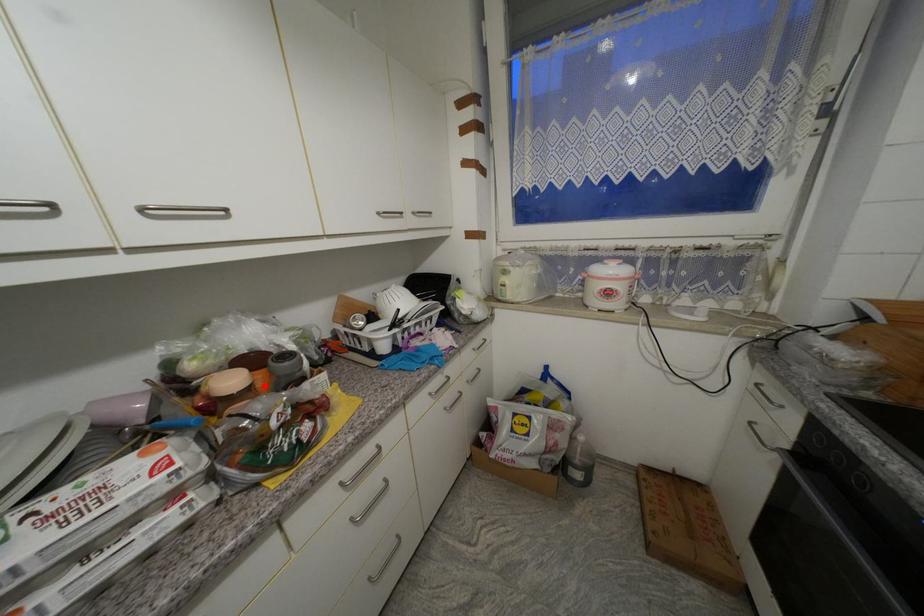
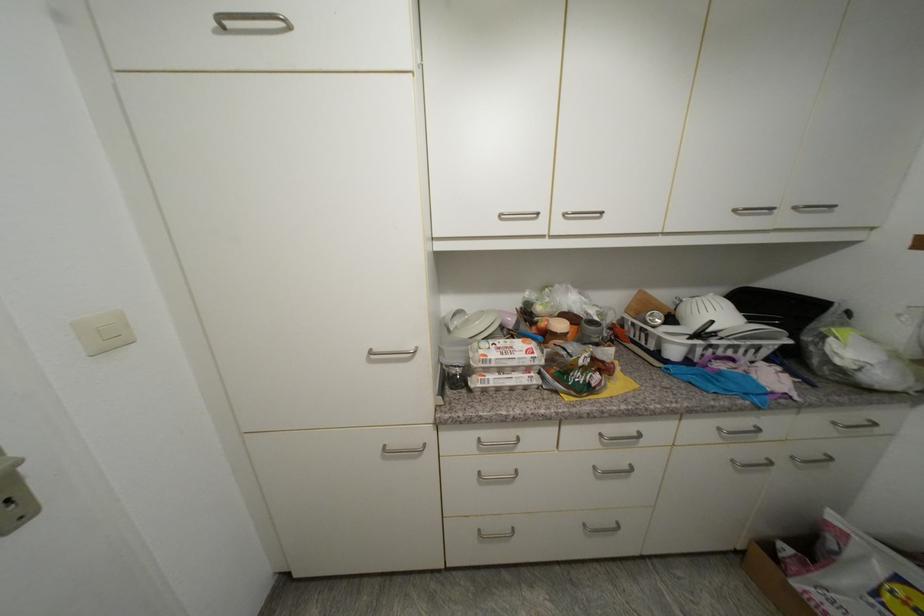
Locate, in the second image, the point that corresponds to the highlighted location in the first image.

(575, 336)